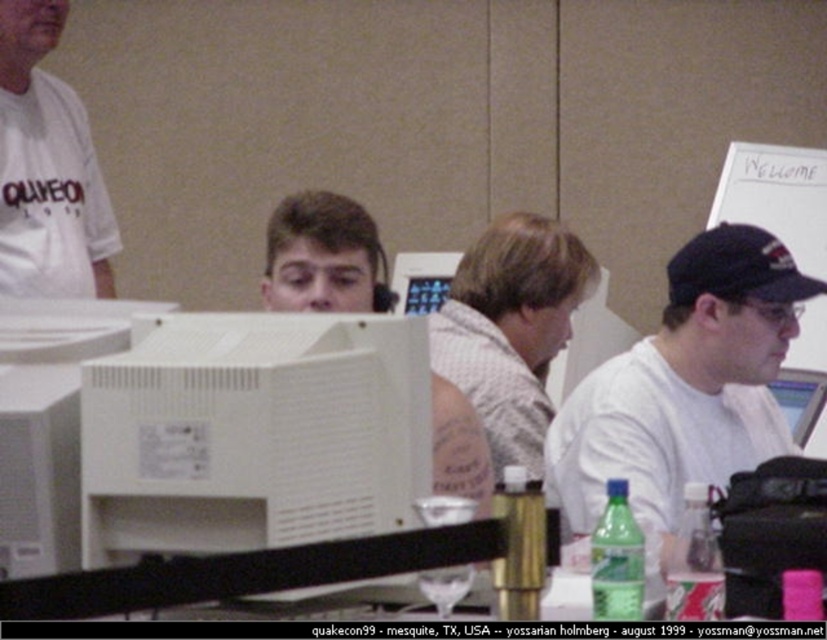
Between point (13, 141) and point (441, 280), which one is positioned behind?

Positioned behind is point (441, 280).

At what (x,y) coordinates should I click in order to perform the action: click on white matte t-shirt at upper left. Please return your answer as a coordinate pair (x, y). The width and height of the screenshot is (827, 640). Looking at the image, I should click on (46, 168).

Does white textured shirt at center have a greater height compared to white plastic monitor at center?

Yes.

Can you confirm if white textured shirt at center is positioned below white plastic monitor at center?

Yes, white textured shirt at center is below white plastic monitor at center.

Where is `white textured shirt at center`? white textured shirt at center is located at coordinates (510, 328).

Image resolution: width=827 pixels, height=640 pixels. Identify the location of white textured shirt at center. (510, 328).

Find the location of a particular element. This screenshot has height=640, width=827. white plastic desktop computer at center is located at coordinates (252, 433).

At what (x,y) coordinates should I click in order to perform the action: click on white plastic desktop computer at center. Please return your answer as a coordinate pair (x, y). Looking at the image, I should click on [252, 433].